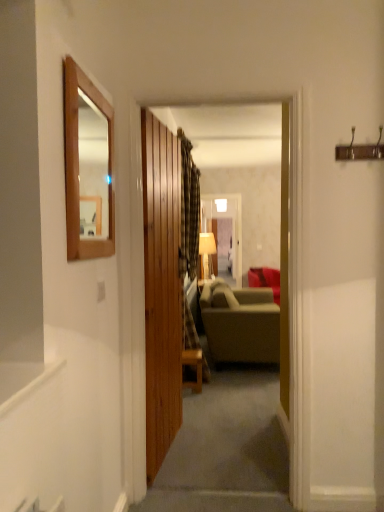
Identify the location of wooden door at center. Image resolution: width=384 pixels, height=512 pixels. (161, 288).

Find the location of a particular element. This screenshot has width=384, height=512. wooden framed mirror at upper left is located at coordinates (88, 167).

This screenshot has width=384, height=512. In order to click on wooden paneling at center in this screenshot , I will do `click(244, 194)`.

Identify the location of wooden table at center. The width and height of the screenshot is (384, 512). (193, 366).

The height and width of the screenshot is (512, 384). What do you see at coordinates (241, 323) in the screenshot?
I see `matte gray fabric couch at center, the 1th studio couch when ordered from front to back` at bounding box center [241, 323].

Describe the element at coordinates (207, 252) in the screenshot. I see `matte beige lampshade at center` at that location.

Image resolution: width=384 pixels, height=512 pixels. Find the location of `matte beige lampshade at center`. matte beige lampshade at center is located at coordinates (207, 252).

In order to click on matte green fabric couch at center, placed as the second studio couch when sorted from front to back in this screenshot , I will do `click(265, 280)`.

Would you say matte gray fabric couch at center, the 1th studio couch when ordered from front to back, contains plaid fabric curtain at center?

No.

Measure the distance from matte gray fabric couch at center, the second studio couch in the back-to-front sequence, to plaid fabric curtain at center.

matte gray fabric couch at center, the second studio couch in the back-to-front sequence, is 78.92 centimeters from plaid fabric curtain at center.

What's the angular difference between matte gray fabric couch at center, the second studio couch in the back-to-front sequence, and plaid fabric curtain at center's facing directions?

The angle between the facing direction of matte gray fabric couch at center, the second studio couch in the back-to-front sequence, and the facing direction of plaid fabric curtain at center is 6.07 degrees.

Is matte gray fabric couch at center, the second studio couch in the back-to-front sequence, positioned far away from plaid fabric curtain at center?

No, matte gray fabric couch at center, the second studio couch in the back-to-front sequence, is not far away from plaid fabric curtain at center.

Consider the image. Does matte beige lampshade at center have a lesser height compared to plaid fabric curtain at center?

Yes, matte beige lampshade at center is shorter than plaid fabric curtain at center.

Is matte beige lampshade at center oriented away from plaid fabric curtain at center?

matte beige lampshade at center does not have its back to plaid fabric curtain at center.

Which is closer to the camera, (201, 259) or (190, 223)?

Point (190, 223)

Does matte beige lampshade at center come in front of plaid fabric curtain at center?

No, matte beige lampshade at center is further to the viewer.

How much distance is there between matte gray fabric couch at center, the second studio couch in the back-to-front sequence, and wooden paneling at center?

The distance of matte gray fabric couch at center, the second studio couch in the back-to-front sequence, from wooden paneling at center is 3.11 meters.

Is matte gray fabric couch at center, the 1th studio couch when ordered from front to back, aimed at wooden paneling at center?

No, matte gray fabric couch at center, the 1th studio couch when ordered from front to back, is not oriented towards wooden paneling at center.

Considering the relative sizes of matte gray fabric couch at center, the 1th studio couch when ordered from front to back, and wooden paneling at center in the image provided, is matte gray fabric couch at center, the 1th studio couch when ordered from front to back, thinner than wooden paneling at center?

Incorrect, the width of matte gray fabric couch at center, the 1th studio couch when ordered from front to back, is not less than that of wooden paneling at center.

From a real-world perspective, who is located lower, matte gray fabric couch at center, the 1th studio couch when ordered from front to back, or wooden paneling at center?

From a 3D spatial view, matte gray fabric couch at center, the 1th studio couch when ordered from front to back, is below.

How different are the orientations of matte green fabric couch at center, placed as the second studio couch when sorted from front to back, and wooden door at center in degrees?

There is a 48-degree angle between the facing directions of matte green fabric couch at center, placed as the second studio couch when sorted from front to back, and wooden door at center.

Is matte green fabric couch at center, placed as the second studio couch when sorted from front to back, bigger than wooden door at center?

Yes, matte green fabric couch at center, placed as the second studio couch when sorted from front to back, is bigger than wooden door at center.

Which object is further away from the camera taking this photo, matte green fabric couch at center, which is counted as the 1th studio couch, starting from the back, or wooden door at center?

matte green fabric couch at center, which is counted as the 1th studio couch, starting from the back, is further away from the camera.

Can you confirm if matte green fabric couch at center, which is counted as the 1th studio couch, starting from the back, is thinner than wooden door at center?

No.

Is wooden framed mirror at upper left behind wooden paneling at center?

No.

Which of these two, wooden framed mirror at upper left or wooden paneling at center, stands shorter?

Standing shorter between the two is wooden framed mirror at upper left.

Is wooden framed mirror at upper left located outside wooden paneling at center?

Indeed, wooden framed mirror at upper left is completely outside wooden paneling at center.

Could you tell me if wooden framed mirror at upper left is turned towards matte beige lampshade at center?

No, wooden framed mirror at upper left is not aimed at matte beige lampshade at center.

Can you confirm if wooden framed mirror at upper left is positioned to the right of matte beige lampshade at center?

No, wooden framed mirror at upper left is not to the right of matte beige lampshade at center.

Based on the photo, measure the distance between wooden framed mirror at upper left and matte beige lampshade at center.

The distance of wooden framed mirror at upper left from matte beige lampshade at center is 5.06 meters.

From the picture: From a real-world perspective, between wooden framed mirror at upper left and matte beige lampshade at center, who is vertically higher?

wooden framed mirror at upper left.

Considering the sizes of objects matte beige lampshade at center and wooden table at center in the image provided, who is taller, matte beige lampshade at center or wooden table at center?

matte beige lampshade at center.

Which object is wider, matte beige lampshade at center or wooden table at center?

matte beige lampshade at center.

Is matte beige lampshade at center turned away from wooden table at center?

That's not correct — matte beige lampshade at center is not looking away from wooden table at center.

Is matte beige lampshade at center bigger than wooden table at center?

Yes, matte beige lampshade at center is bigger than wooden table at center.

Locate an element on the screen. Image resolution: width=384 pixels, height=512 pixels. curtain that appears above the matte gray fabric couch at center, the second studio couch in the back-to-front sequence (from the image's perspective) is located at coordinates (189, 211).

Identify the location of light fixture that is below the plaid fabric curtain at center (from the image's perspective). (207, 252).

Considering their positions, is plaid fabric curtain at center positioned further to matte gray fabric couch at center, the 1th studio couch when ordered from front to back, than wooden paneling at center?

Based on the image, wooden paneling at center appears to be further to matte gray fabric couch at center, the 1th studio couch when ordered from front to back.

Which object lies further to the anchor point wooden door at center, matte beige lampshade at center or matte green fabric couch at center, which is counted as the 1th studio couch, starting from the back?

matte beige lampshade at center is further to wooden door at center.

Estimate the real-world distances between objects in this image. Which object is closer to matte green fabric couch at center, which is counted as the 1th studio couch, starting from the back, plaid fabric curtain at center or wooden table at center?

plaid fabric curtain at center lies closer to matte green fabric couch at center, which is counted as the 1th studio couch, starting from the back, than the other object.

From the image, which object appears to be nearer to matte green fabric couch at center, which is counted as the 1th studio couch, starting from the back, matte gray fabric couch at center, the 1th studio couch when ordered from front to back, or matte beige lampshade at center?

matte beige lampshade at center is closer to matte green fabric couch at center, which is counted as the 1th studio couch, starting from the back.

When comparing their distances from wooden table at center, does matte beige lampshade at center or wooden door at center seem further?

matte beige lampshade at center is further to wooden table at center.

Based on their spatial positions, is matte beige lampshade at center or wooden door at center closer to wooden framed mirror at upper left?

wooden door at center is positioned closer to the anchor wooden framed mirror at upper left.

Considering their positions, is matte gray fabric couch at center, the second studio couch in the back-to-front sequence, positioned further to wooden paneling at center than wooden table at center?

wooden table at center lies further to wooden paneling at center than the other object.

Which object lies further to the anchor point matte green fabric couch at center, which is counted as the 1th studio couch, starting from the back, wooden door at center or wooden framed mirror at upper left?

Among the two, wooden framed mirror at upper left is located further to matte green fabric couch at center, which is counted as the 1th studio couch, starting from the back.

The image size is (384, 512). I want to click on studio couch between wooden paneling at center and matte green fabric couch at center, which is counted as the 1th studio couch, starting from the back, from front to back, so click(241, 323).

This screenshot has width=384, height=512. Identify the location of table positioned between wooden framed mirror at upper left and matte beige lampshade at center from near to far. (193, 366).

You are a GUI agent. You are given a task and a screenshot of the screen. Output one action in this format:
    pyautogui.click(x=<x>, y=<y>)
    Task: Click on the light fixture between wooden paneling at center and matte green fabric couch at center, which is counted as the 1th studio couch, starting from the back, from front to back
    This screenshot has height=512, width=384.
    Given the screenshot: What is the action you would take?
    pyautogui.click(x=207, y=252)

Locate an element on the screen. Image resolution: width=384 pixels, height=512 pixels. table between wooden paneling at center and matte beige lampshade at center from front to back is located at coordinates (193, 366).